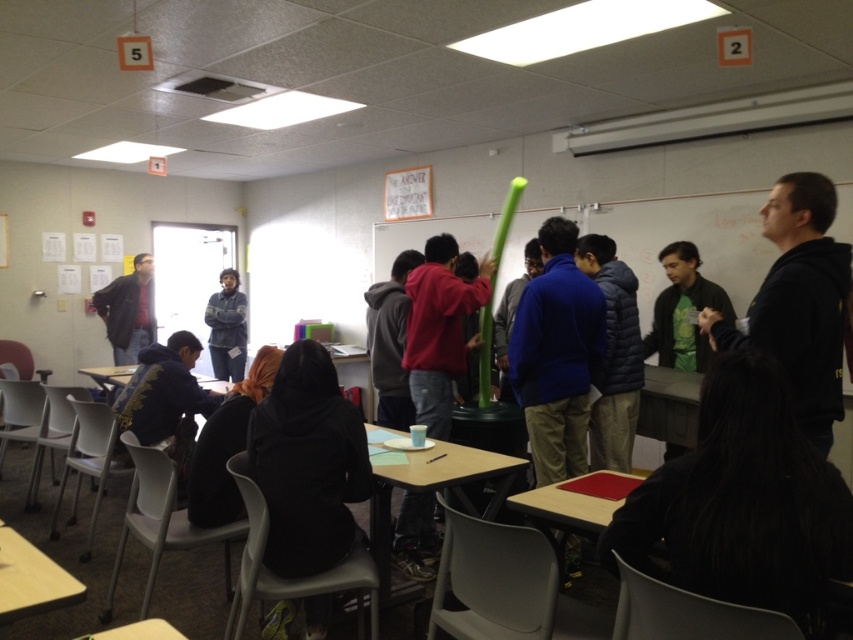
You are a participant in the classroom activity and need to reach the wooden table at lower center. There is a green foam pole at center blocking your path. Can you walk around it to get to the table?

The green foam pole at center is closer to the viewer than the wooden table at lower center, so you can walk around it to reach the wooden table at lower center.

You are a student in the classroom and need to place a 1.2 meter tall poster on the wall. The poster needs to be placed above the green foam pole at center and the wooden table at lower center. Which object should you place it above to ensure the poster is visible to everyone in the room?

The green foam pole at center is taller than the wooden table at lower center. To ensure visibility, place the poster above the green foam pole at center since it has a greater height, providing a higher position for the poster.